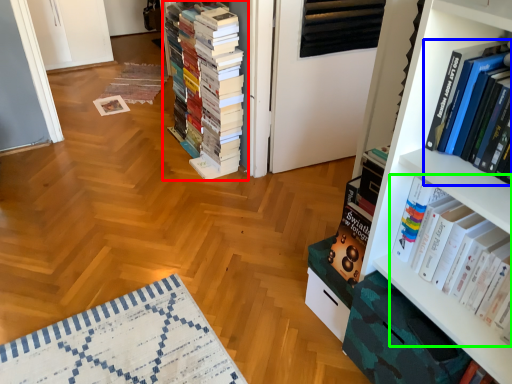
Question: Estimate the real-world distances between objects in this image. Which object is closer to book (highlighted by a red box), book (highlighted by a blue box) or book (highlighted by a green box)?

Choices:
 (A) book
 (B) book

Answer: (B)